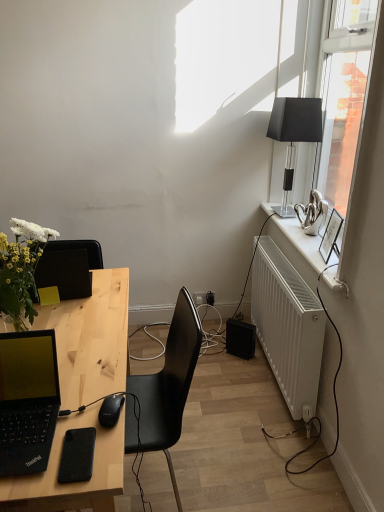
You are a GUI agent. You are given a task and a screenshot of the screen. Output one action in this format:
    pyautogui.click(x=<x>, y=<y>)
    Task: Click on the vacant space that is to the left of black plastic speaker at lower right
    
    Given the screenshot: What is the action you would take?
    pyautogui.click(x=219, y=352)